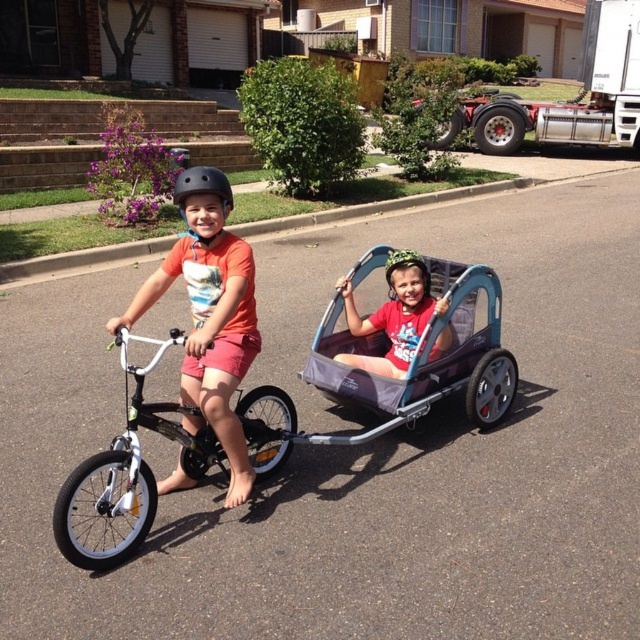
Question: Is teal fabric baby carriage at center further to the viewer compared to matte black helmet at center?

Choices:
 (A) no
 (B) yes

Answer: (A)

Question: Which of the following is the farthest from the observer?

Choices:
 (A) (422, 330)
 (B) (488, 381)
 (C) (180, 205)
 (D) (214, 371)

Answer: (B)

Question: Which object is positioned closest to the white matte bicycle at center?

Choices:
 (A) orange matte helmet at center
 (B) red cotton shirt at center
 (C) matte black helmet at center
 (D) teal fabric baby carriage at center

Answer: (A)

Question: Which point appears farthest from the camera in this image?

Choices:
 (A) (228, 184)
 (B) (458, 282)
 (C) (192, 417)

Answer: (A)

Question: Is black matte bicycle helmet at upper center positioned at the back of matte black helmet at center?

Choices:
 (A) no
 (B) yes

Answer: (A)

Question: Is the position of orange matte helmet at center less distant than that of black matte bicycle helmet at upper center?

Choices:
 (A) yes
 (B) no

Answer: (A)